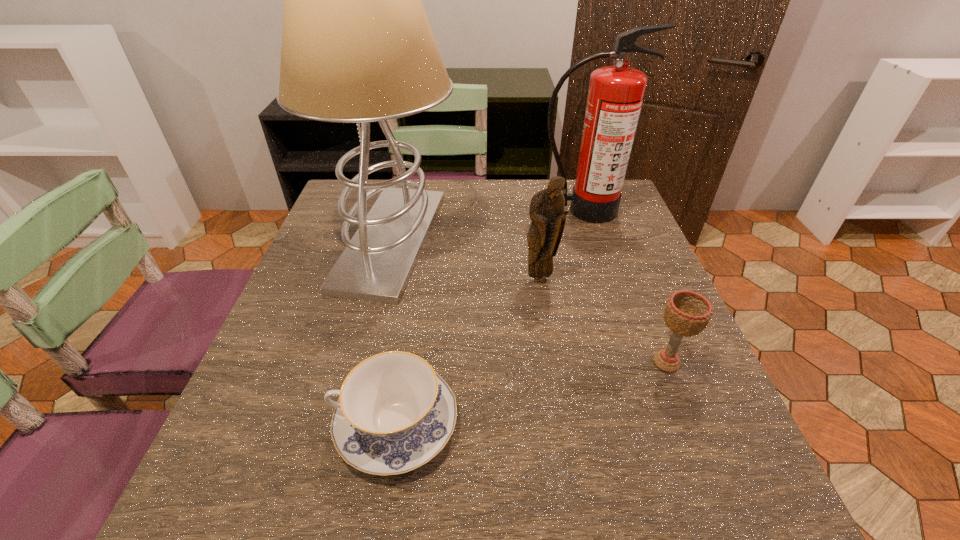
You are a GUI agent. You are given a task and a screenshot of the screen. Output one action in this format:
    pyautogui.click(x=<x>, y=<y>)
    Task: Click on the vacant area between the figurine and the table lamp
    This screenshot has height=540, width=960.
    Given the screenshot: What is the action you would take?
    pyautogui.click(x=466, y=260)

At what (x,y) coordinates should I click in order to perform the action: click on free space between the chalice and the table lamp. Please return your answer as a coordinate pair (x, y). Looking at the image, I should click on (529, 301).

Find the location of `free space that is in between the chinaware and the table lamp`. free space that is in between the chinaware and the table lamp is located at coordinates (394, 332).

Image resolution: width=960 pixels, height=540 pixels. In order to click on free space between the chalice and the third tallest object in this screenshot , I will do `click(603, 321)`.

At what (x,y) coordinates should I click in order to perform the action: click on empty space between the shortest object and the table lamp. Please return your answer as a coordinate pair (x, y). Looking at the image, I should click on (394, 332).

The width and height of the screenshot is (960, 540). In order to click on empty space between the fire extinguisher and the tallest object in this screenshot , I will do `click(488, 225)`.

The width and height of the screenshot is (960, 540). I want to click on vacant area that lies between the tallest object and the figurine, so click(466, 260).

You are a GUI agent. You are given a task and a screenshot of the screen. Output one action in this format:
    pyautogui.click(x=<x>, y=<y>)
    Task: Click on the object that can be found as the closest to the fire extinguisher
    
    Given the screenshot: What is the action you would take?
    pyautogui.click(x=546, y=211)

Locate which object ranks fourth in proximity to the chinaware. Please provide its 2D coordinates. Your answer should be formatted as a tuple, i.e. [(x, y)], where the tuple contains the x and y coordinates of a point satisfying the conditions above.

[(615, 96)]

Identify the location of vacant region that satisfies the following two spatial constraints: 1. on the front-facing side of the chalice; 2. on the left side of the fourth shortest object. click(x=633, y=362).